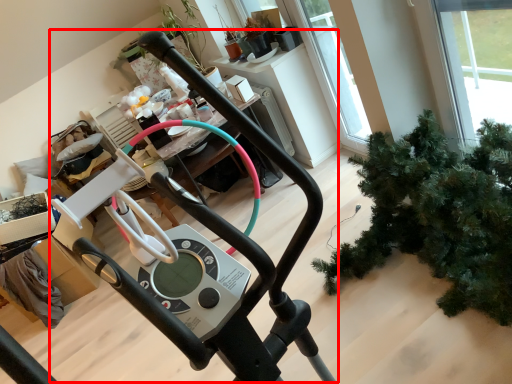
Question: In this image, where is sport equipment (annotated by the red box) located relative to houseplant?

Choices:
 (A) left
 (B) right

Answer: (A)